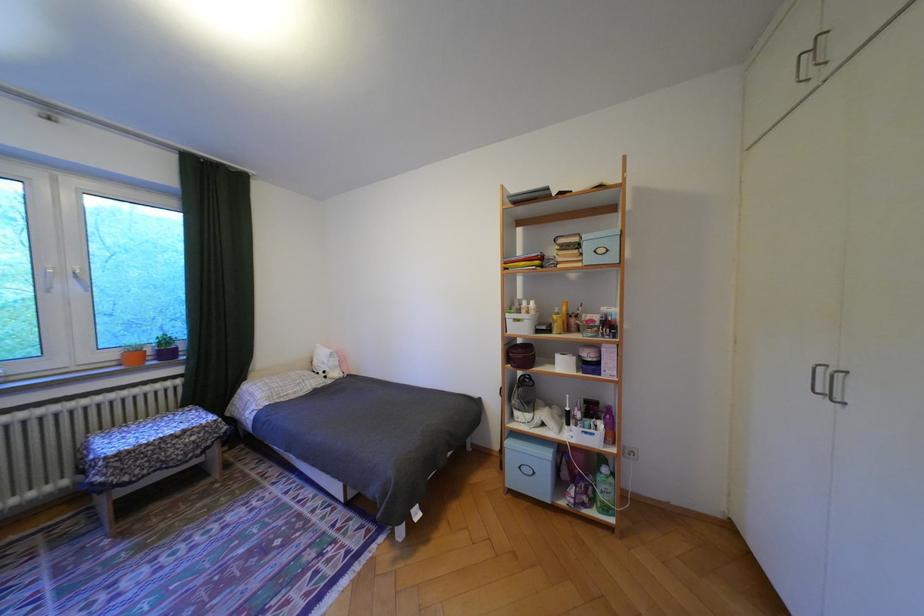
The image size is (924, 616). In order to click on white window handle in this screenshot , I will do `click(79, 277)`.